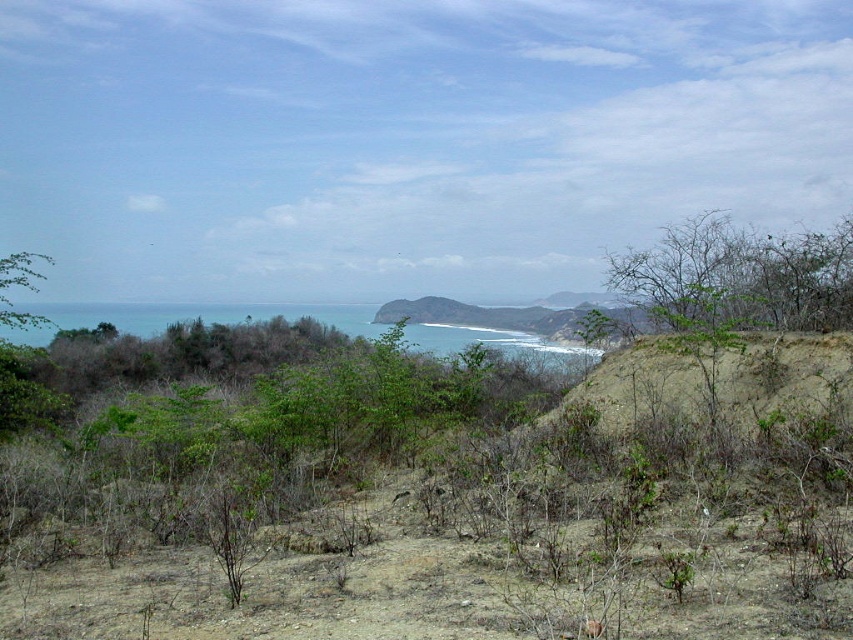
Question: Which of these objects is positioned farthest from the green leafy bush at left?

Choices:
 (A) blue water at center
 (B) green leafy bush at right

Answer: (B)

Question: Does blue water at center appear on the left side of green leafy bush at left?

Choices:
 (A) yes
 (B) no

Answer: (B)

Question: Considering the relative positions of green leafy bush at right and green leafy bush at left in the image provided, where is green leafy bush at right located with respect to green leafy bush at left?

Choices:
 (A) left
 (B) right

Answer: (B)

Question: Which object is closer to the camera taking this photo?

Choices:
 (A) green leafy bush at left
 (B) green leafy bush at right
 (C) blue water at center

Answer: (B)

Question: Which of these objects is positioned farthest from the green leafy bush at left?

Choices:
 (A) green leafy bush at right
 (B) blue water at center

Answer: (A)

Question: Does blue water at center come behind green leafy bush at left?

Choices:
 (A) yes
 (B) no

Answer: (A)